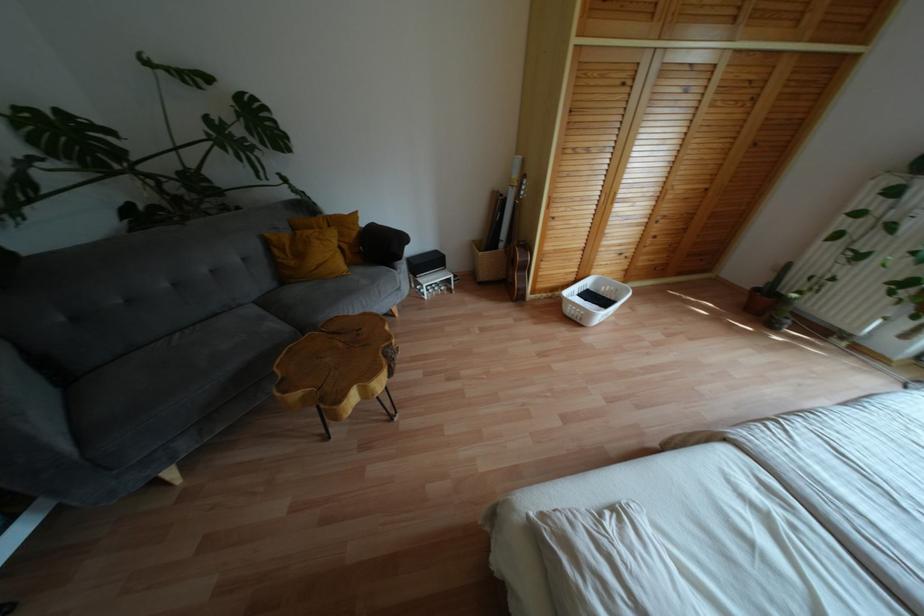
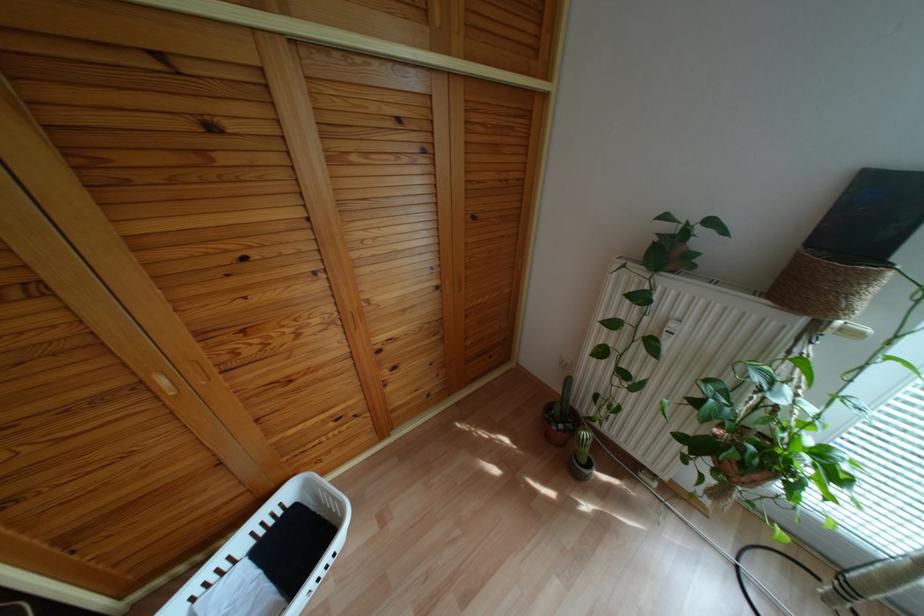
Find the pixel in the second image that matches [586,283] in the first image.

(287, 493)